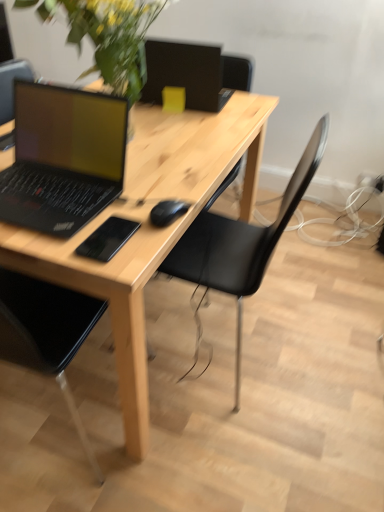
The width and height of the screenshot is (384, 512). I want to click on vacant area that lies to the right of green leafy plant at upper left, so click(208, 148).